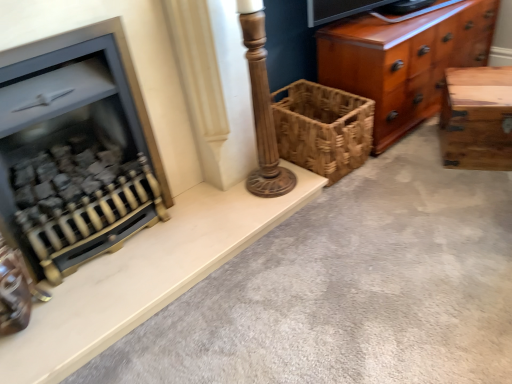
Find the location of a particular element. This screenshot has height=384, width=512. free space to the left of wooden column at center is located at coordinates (219, 195).